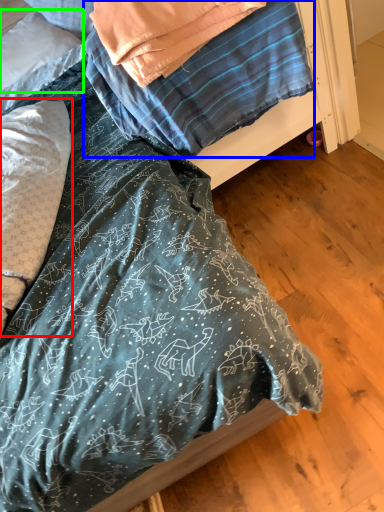
Question: Which object is positioned closest to pillow (highlighted by a red box)? Select from blanket (highlighted by a blue box) and pillow (highlighted by a green box).

Choices:
 (A) blanket
 (B) pillow

Answer: (A)